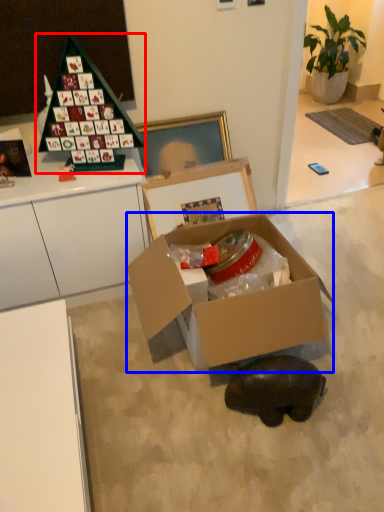
Question: Among these objects, which one is nearest to the camera, toy (highlighted by a red box) or box (highlighted by a blue box)?

Choices:
 (A) toy
 (B) box

Answer: (B)